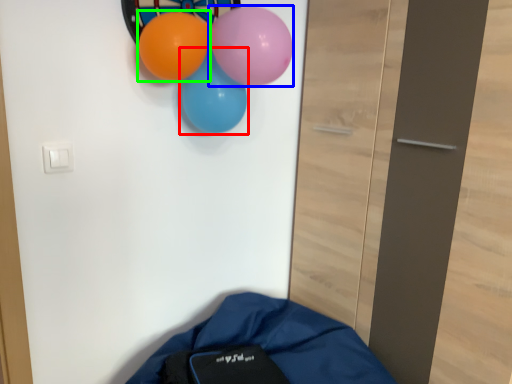
Question: Based on their relative distances, which object is nearer to balloon (highlighted by a red box)? Choose from balloon (highlighted by a blue box) and balloon (highlighted by a green box).

Choices:
 (A) balloon
 (B) balloon

Answer: (B)